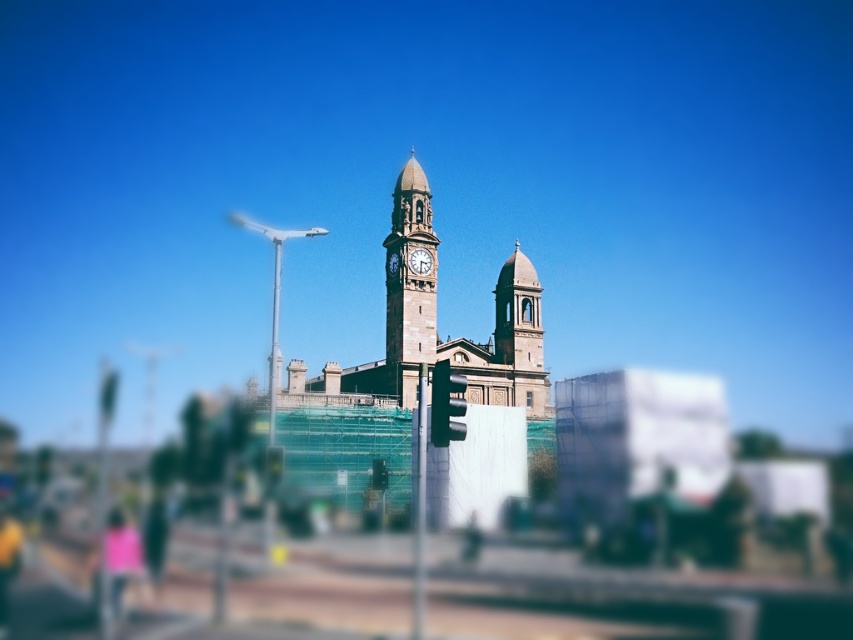
Question: Which of the following is the closest to the observer?

Choices:
 (A) white stone clock at center
 (B) stone clock tower at center
 (C) green metallic clock tower at center

Answer: (B)

Question: Does smooth stone tower at center have a greater width compared to pink fabric at lower left?

Choices:
 (A) yes
 (B) no

Answer: (B)

Question: Estimate the real-world distances between objects in this image. Which object is closer to the stone clock tower at center?

Choices:
 (A) green metallic clock tower at center
 (B) pink fabric at lower left

Answer: (A)

Question: Among these objects, which one is nearest to the camera?

Choices:
 (A) stone clock tower at center
 (B) smooth stone tower at center

Answer: (A)

Question: Does stone clock tower at center have a larger size compared to pink fabric at lower left?

Choices:
 (A) no
 (B) yes

Answer: (B)

Question: Is white stone clock at center to the left of green metallic clock tower at center from the viewer's perspective?

Choices:
 (A) yes
 (B) no

Answer: (B)